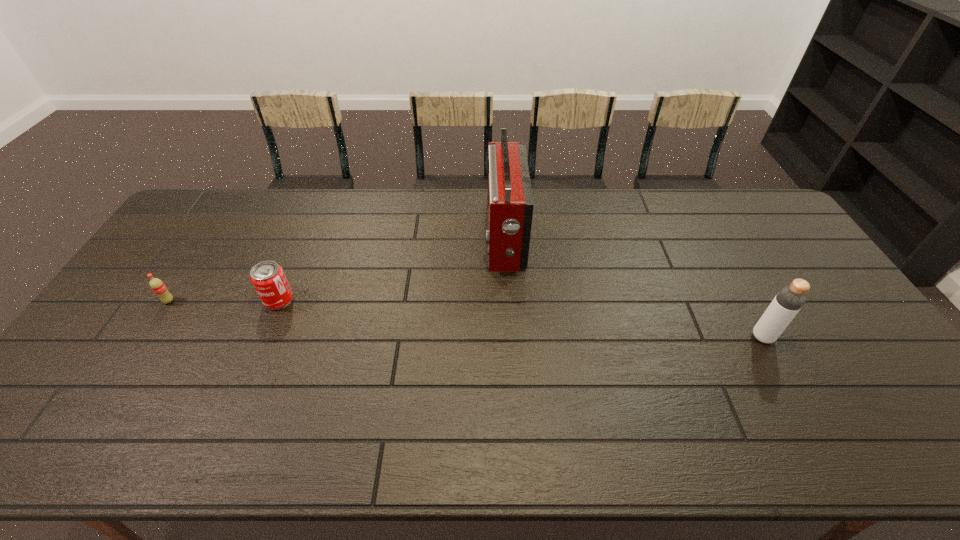
Identify the location of vacant space in between the soda and the farthest object. (337, 270).

Locate an element on the screen. The height and width of the screenshot is (540, 960). empty space that is in between the nearest object and the soda is located at coordinates (466, 319).

I want to click on empty location between the tallest object and the third shortest object, so click(634, 288).

Where is `unoccupied area between the second tallest object and the leftmost object`? Image resolution: width=960 pixels, height=540 pixels. unoccupied area between the second tallest object and the leftmost object is located at coordinates coord(466,319).

Where is `free space between the soda and the second tallest object`? free space between the soda and the second tallest object is located at coordinates (466, 319).

Find the location of a particular element. free area in between the soda and the rightmost object is located at coordinates (466, 319).

The width and height of the screenshot is (960, 540). Identify the location of free space between the rightmost object and the leftmost object. (466, 319).

Identify the location of vacant space that is in between the soda and the tallest object. The image size is (960, 540). (337, 270).

You are a GUI agent. You are given a task and a screenshot of the screen. Output one action in this format:
    pyautogui.click(x=<x>, y=<y>)
    Task: Click on the object that is the second closest to the nearest object
    
    Given the screenshot: What is the action you would take?
    pyautogui.click(x=268, y=278)

Point out which object is positioned as the nearest to the second object from right to left. Please provide its 2D coordinates. Your answer should be formatted as a tuple, i.e. [(x, y)], where the tuple contains the x and y coordinates of a point satisfying the conditions above.

[(268, 278)]